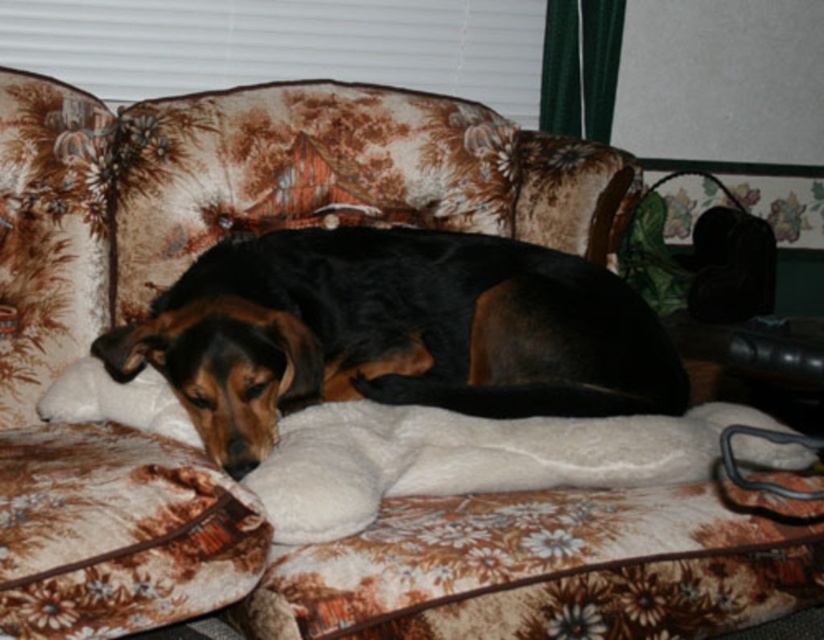
Question: Considering the relative positions of floral fabric couch at center and black fur dog at center in the image provided, where is floral fabric couch at center located with respect to black fur dog at center?

Choices:
 (A) below
 (B) above

Answer: (B)

Question: Is floral fabric couch at center below black fur dog at center?

Choices:
 (A) no
 (B) yes

Answer: (A)

Question: Which of the following is the farthest from the observer?

Choices:
 (A) (604, 369)
 (B) (382, 218)

Answer: (B)

Question: Is floral fabric couch at center to the right of black fur dog at center from the viewer's perspective?

Choices:
 (A) no
 (B) yes

Answer: (A)